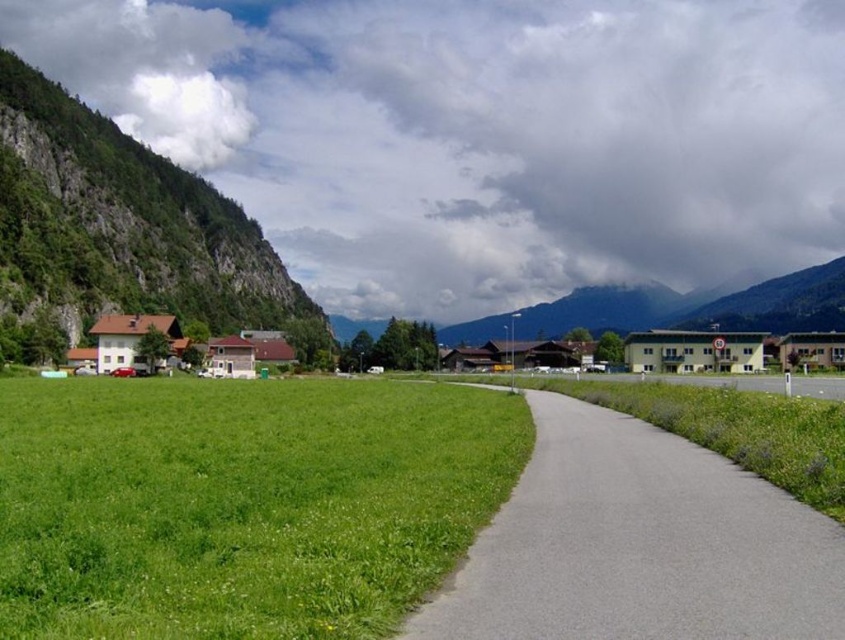
Question: Which of these objects is positioned farthest from the brown wooden house at left?

Choices:
 (A) gray asphalt path at center
 (B) green grass at lower left

Answer: (A)

Question: Is green rocky mountain at left behind brown wooden house at left?

Choices:
 (A) no
 (B) yes

Answer: (A)

Question: Does green grass at lower left have a lesser width compared to gray asphalt path at center?

Choices:
 (A) no
 (B) yes

Answer: (A)

Question: Among these points, which one is nearest to the camera?

Choices:
 (A) (555, 573)
 (B) (140, 387)
 (C) (233, 360)
 (D) (101, 116)

Answer: (A)

Question: Does gray asphalt path at center appear over brown wooden house at left?

Choices:
 (A) no
 (B) yes

Answer: (A)

Question: Estimate the real-world distances between objects in this image. Which object is closer to the gray asphalt path at center?

Choices:
 (A) brown wooden house at left
 (B) green grass at lower left
 (C) green rocky mountain at left

Answer: (B)